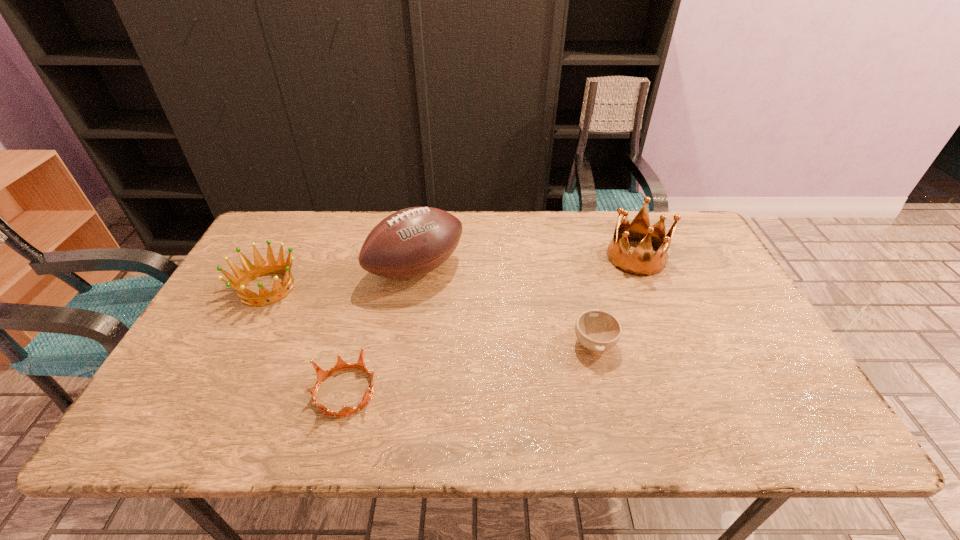
Locate an element on the screen. The height and width of the screenshot is (540, 960). the tallest object is located at coordinates (411, 242).

The width and height of the screenshot is (960, 540). Find the location of `the rightmost crown`. the rightmost crown is located at coordinates (641, 262).

The image size is (960, 540). In order to click on the tallest crown in this screenshot , I will do `click(641, 262)`.

The width and height of the screenshot is (960, 540). In order to click on the second tallest crown in this screenshot , I will do [x=261, y=267].

You are a GUI agent. You are given a task and a screenshot of the screen. Output one action in this format:
    pyautogui.click(x=<x>, y=<y>)
    Task: Click on the leftmost crown
    This screenshot has width=960, height=540.
    Given the screenshot: What is the action you would take?
    pyautogui.click(x=261, y=267)

The height and width of the screenshot is (540, 960). Identify the location of bowl. (596, 330).

The height and width of the screenshot is (540, 960). I want to click on the nearest crown, so click(x=341, y=364).

You are a GUI agent. You are given a task and a screenshot of the screen. Output one action in this format:
    pyautogui.click(x=<x>, y=<y>)
    Task: Click on the shortest crown
    The height and width of the screenshot is (540, 960).
    Given the screenshot: What is the action you would take?
    pyautogui.click(x=341, y=364)

Where is `vacant space located on the right of the tallest object`? vacant space located on the right of the tallest object is located at coordinates (537, 270).

This screenshot has height=540, width=960. I want to click on vacant space located 0.220m on the left of the tallest crown, so click(x=536, y=258).